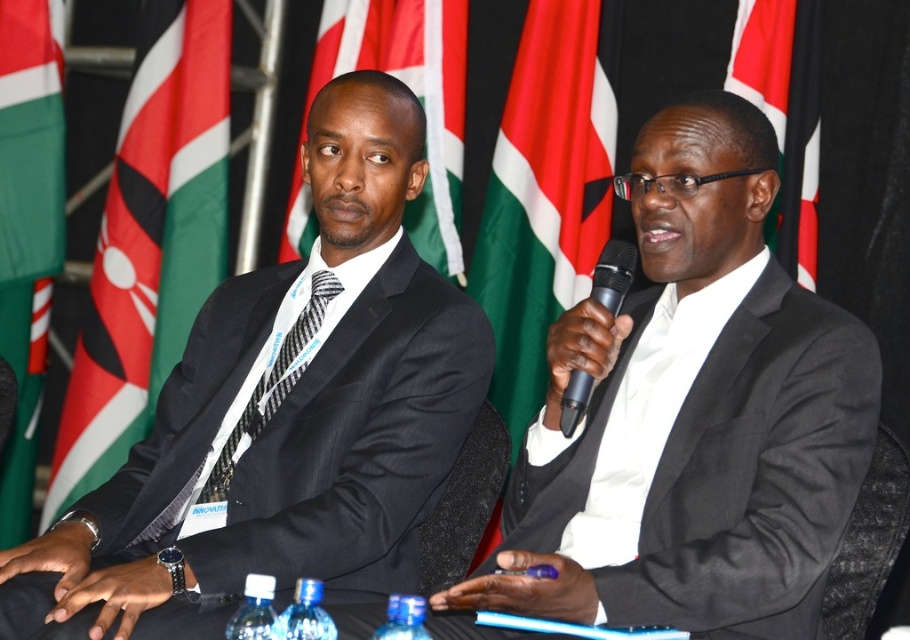
Question: Which point is farther from the camera taking this photo?

Choices:
 (A) (258, 429)
 (B) (91, 355)

Answer: (B)

Question: Can you confirm if green fabric flag at upper center is thinner than black carbon fiber tie at center?

Choices:
 (A) yes
 (B) no

Answer: (B)

Question: Considering the real-world distances, which object is farthest from the green fabric flag at upper left?

Choices:
 (A) matte black suit at left
 (B) black plastic microphone at center
 (C) black carbon fiber tie at center

Answer: (B)

Question: Which of the following is the closest to the observer?

Choices:
 (A) red fabric flag at upper right
 (B) white glossy suit at center

Answer: (B)

Question: Can you confirm if green fabric flag at upper left is positioned above black plastic microphone at center?

Choices:
 (A) no
 (B) yes

Answer: (B)

Question: Is red fabric flag at center to the right of black plastic microphone at center from the viewer's perspective?

Choices:
 (A) yes
 (B) no

Answer: (B)